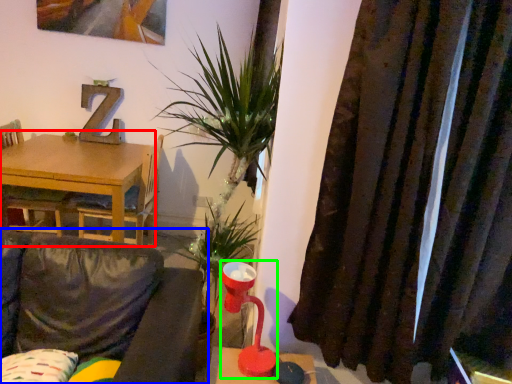
Question: Which object is positioned closest to table (highlighted by a red box)? Select from studio couch (highlighted by a blue box) and table lamp (highlighted by a green box).

Choices:
 (A) studio couch
 (B) table lamp

Answer: (A)